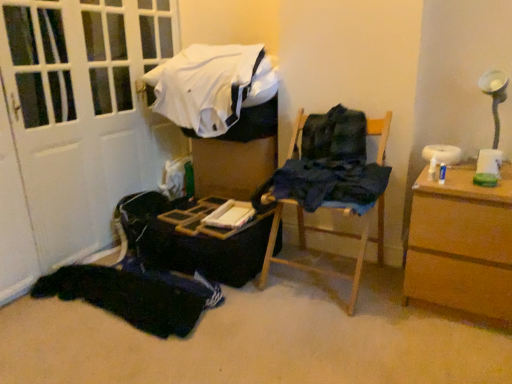
Where is `free space in front of wooden chair at center`? free space in front of wooden chair at center is located at coordinates (335, 334).